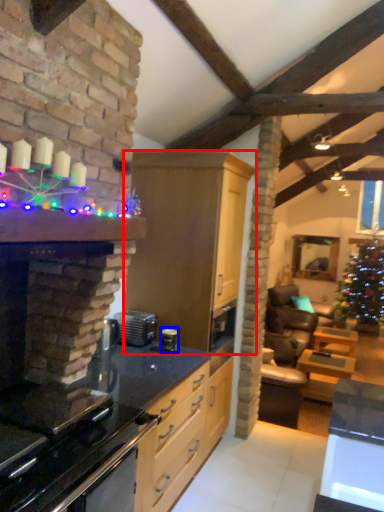
Question: Which object is further to the camera taking this photo, cabinetry (highlighted by a red box) or appliance (highlighted by a blue box)?

Choices:
 (A) cabinetry
 (B) appliance

Answer: (B)